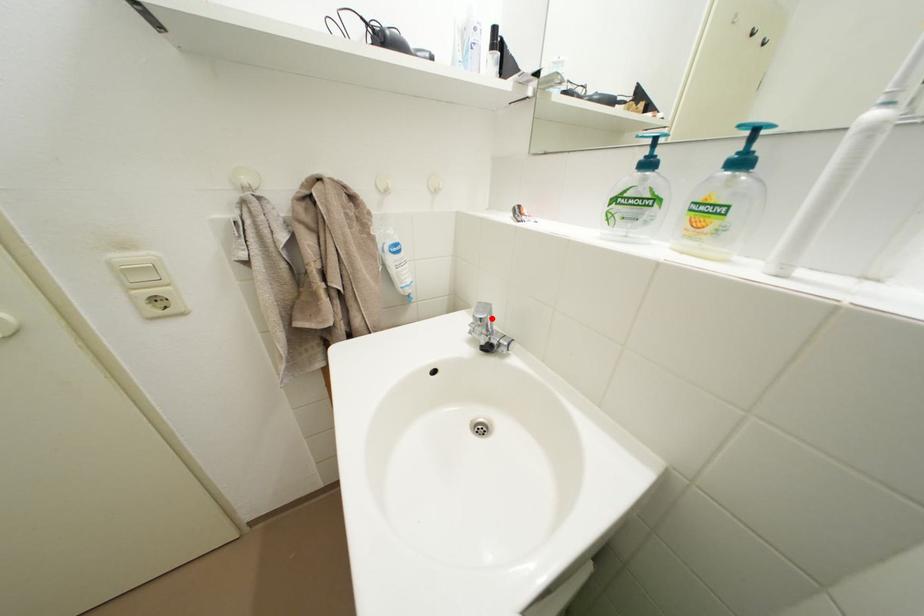
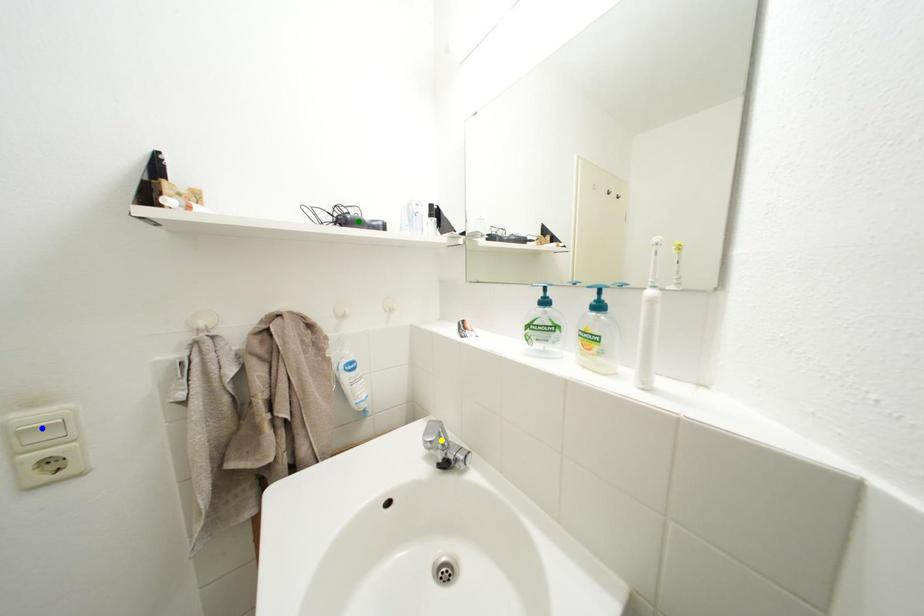
Question: I am providing you with two images of the same scene from different viewpoints. A red point is marked on the first image. You are given multiple points on the second image. Which mark in image 2 goes with the point in image 1?

Choices:
 (A) green point
 (B) yellow point
 (C) blue point

Answer: (B)